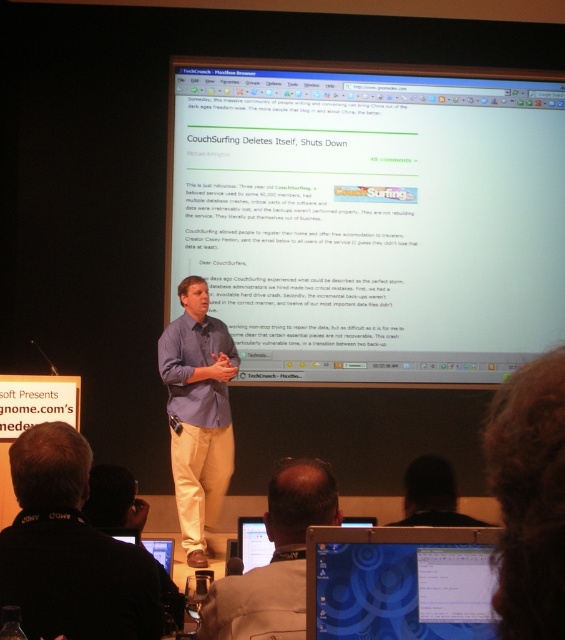
Is blue glossy laptop at lower center taller than black matte shirt at lower center?

Correct, blue glossy laptop at lower center is much taller as black matte shirt at lower center.

Between blue glossy laptop at lower center and black matte shirt at lower center, which one has less height?

black matte shirt at lower center is shorter.

Find the location of a particular element. blue glossy laptop at lower center is located at coordinates (399, 582).

Which is behind, point (488, 444) or point (453, 476)?

The point (453, 476) is behind.

Is dark curly hair at upper right wider than black matte shirt at lower center?

In fact, dark curly hair at upper right might be narrower than black matte shirt at lower center.

Locate an element on the screen. This screenshot has width=565, height=640. dark curly hair at upper right is located at coordinates (529, 497).

Can you confirm if matte blue shirt at center is positioned below white glossy phone at lower center?

No.

Between matte blue shirt at center and white glossy phone at lower center, which one is positioned lower?

Positioned lower is white glossy phone at lower center.

Which is in front, point (71, 588) or point (262, 538)?

Positioned in front is point (71, 588).

Where is `matte blue shirt at center`? The image size is (565, 640). matte blue shirt at center is located at coordinates [x=69, y=548].